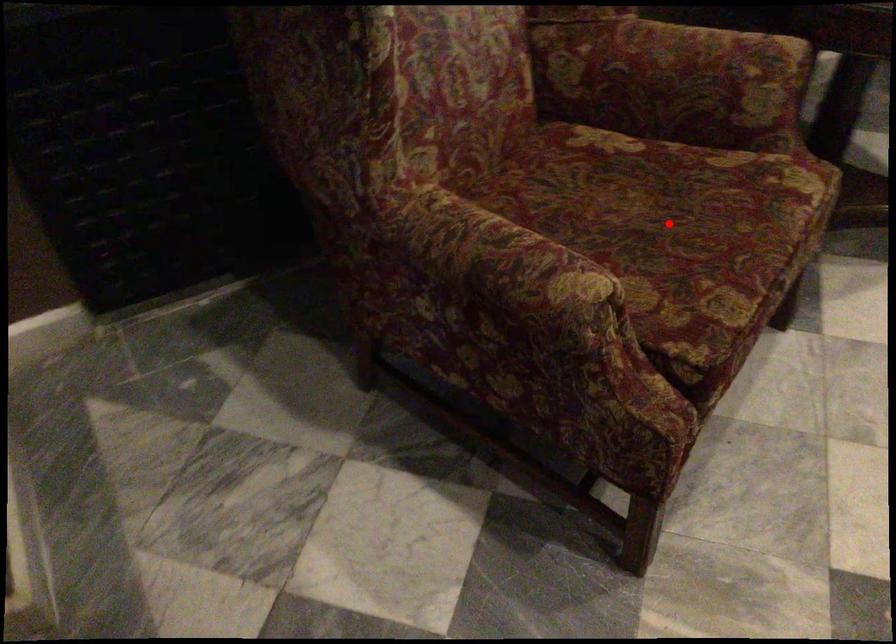
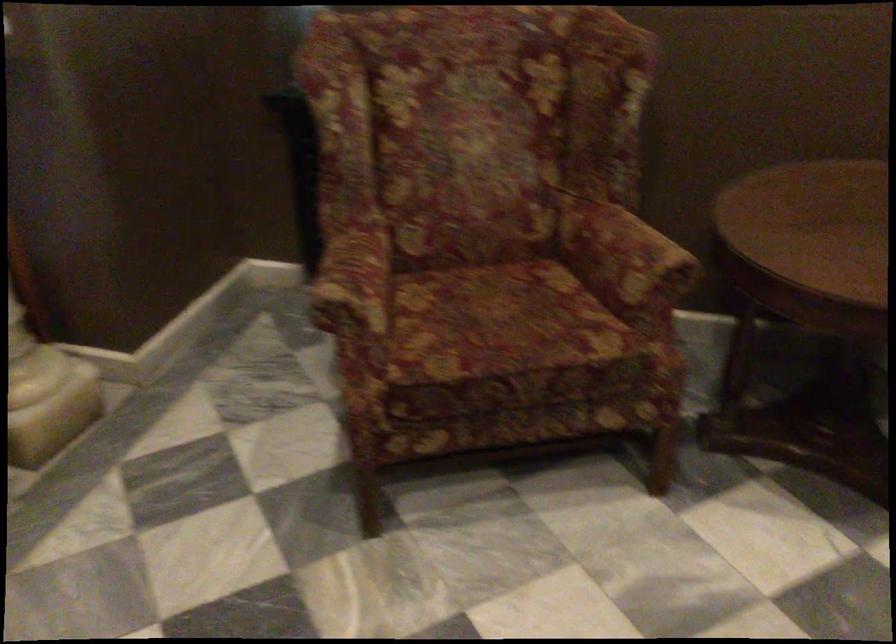
Locate, in the second image, the point that corresponds to the highlighted location in the first image.

(501, 323)